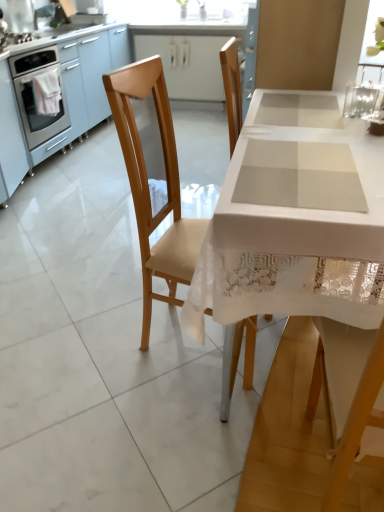
Where is `free space above matte white cabinet at upper center (from a real-world perspective)`? Image resolution: width=384 pixels, height=512 pixels. free space above matte white cabinet at upper center (from a real-world perspective) is located at coordinates (189, 32).